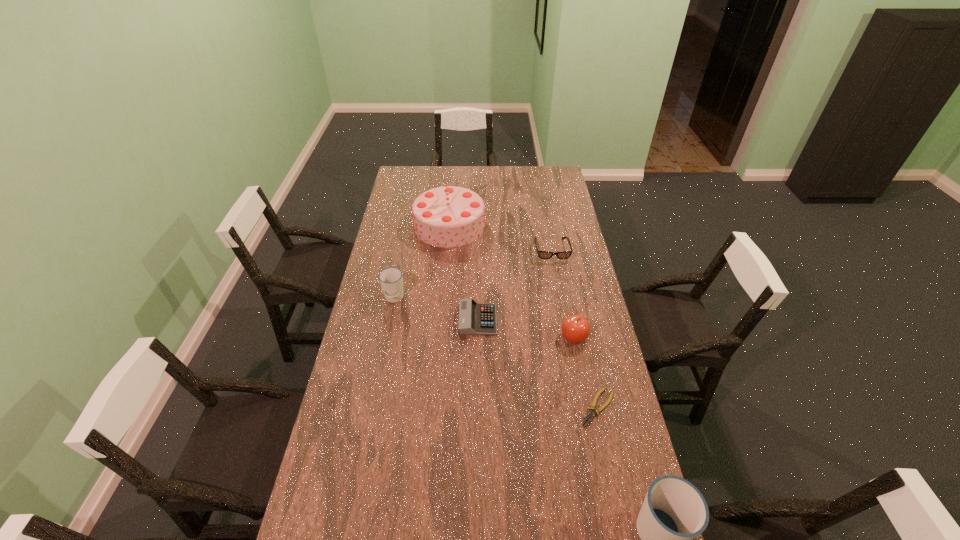
To make them evenly spaced by inserting another cup among them, please locate a free space for this new cup. Please provide its 2D coordinates. Your answer should be formatted as a tuple, i.e. [(x, y)], where the tuple contains the x and y coordinates of a point satisfying the conditions above.

[(498, 392)]